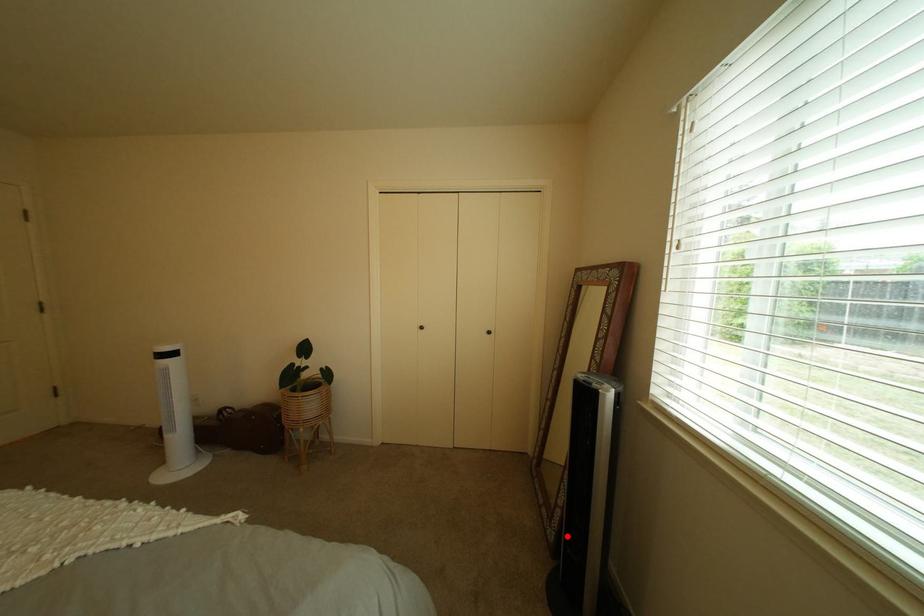
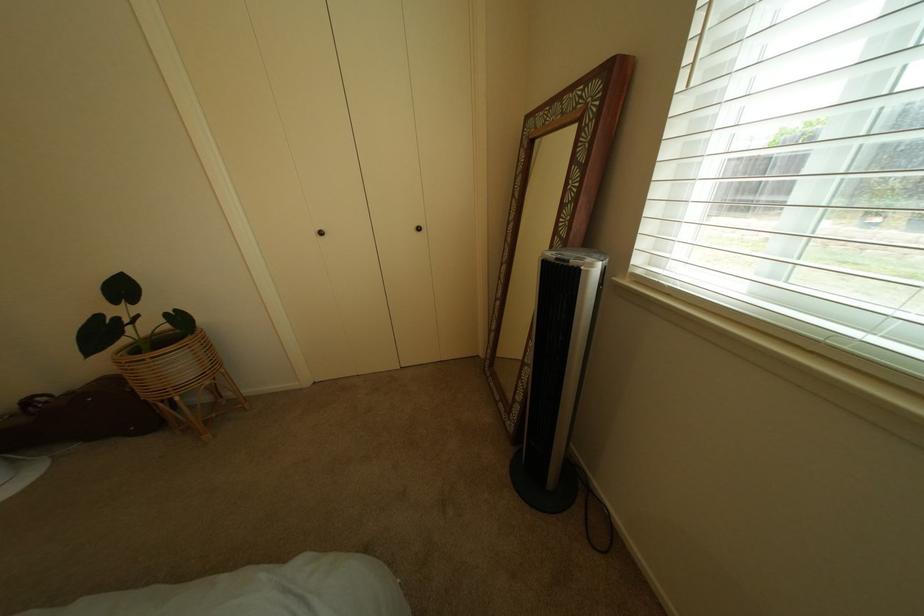
Question: I am providing you with two images of the same scene from different viewpoints. Image1 has a red point marked. In image2, the corresponding 3D location appears at what relative position? Reply with the corresponding letter.

Choices:
 (A) Closer
 (B) Farther

Answer: (A)